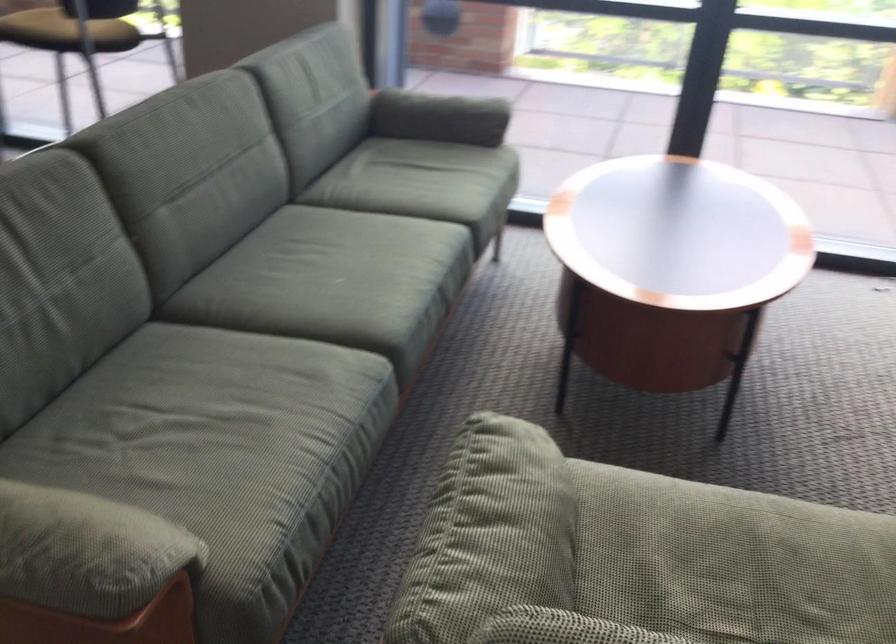
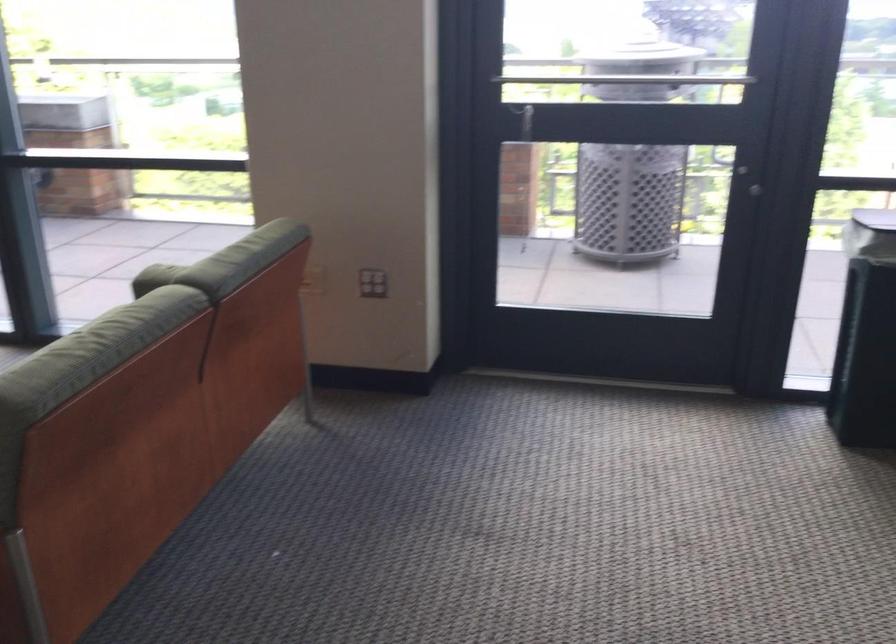
Question: Which direction would the cameraman need to move to produce the second image? Reply with the corresponding letter.

Choices:
 (A) Left
 (B) Right
 (C) Forward
 (D) Backward

Answer: (B)